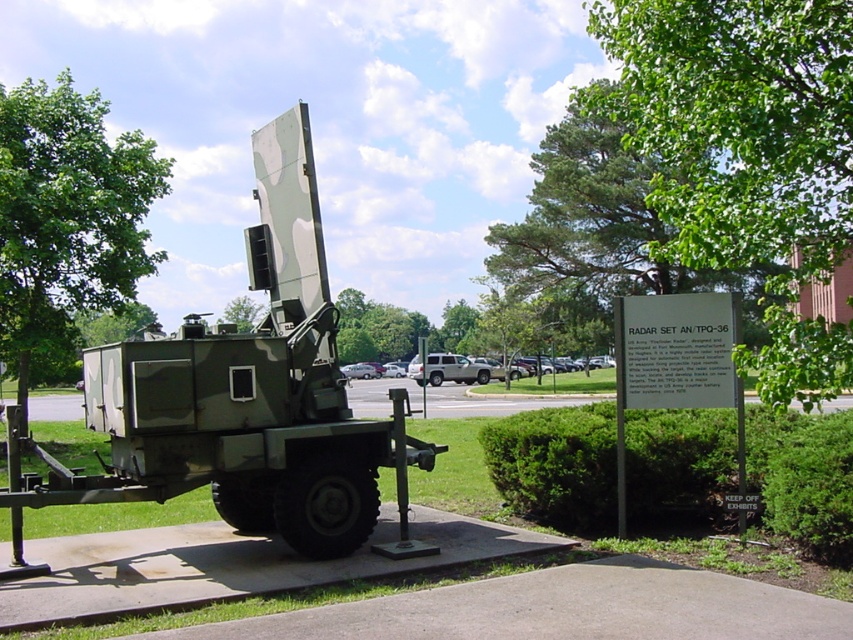
Between camouflage painted radar set at center and silver metallic suv at center, which one is positioned lower?

silver metallic suv at center is below.

Who is higher up, camouflage painted radar set at center or silver metallic suv at center?

camouflage painted radar set at center

This screenshot has width=853, height=640. What do you see at coordinates (241, 396) in the screenshot?
I see `camouflage painted radar set at center` at bounding box center [241, 396].

Locate an element on the screen. camouflage painted radar set at center is located at coordinates (241, 396).